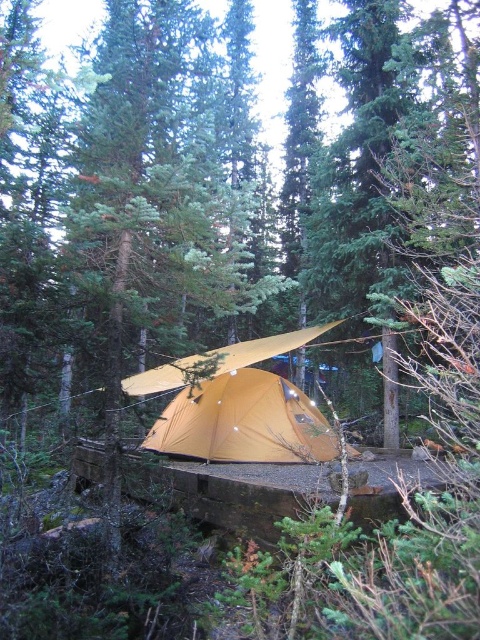
Question: Which point appears closest to the camera in this image?

Choices:
 (A) (252, 353)
 (B) (309, 440)

Answer: (B)

Question: Can you confirm if matte yellow tent at center is positioned above matte yellow tarp at center?

Choices:
 (A) no
 (B) yes

Answer: (A)

Question: Does matte yellow tent at center appear over matte yellow tarp at center?

Choices:
 (A) yes
 (B) no

Answer: (B)

Question: Is matte yellow tent at center behind matte yellow tarp at center?

Choices:
 (A) yes
 (B) no

Answer: (A)

Question: Which point is farther to the camera?

Choices:
 (A) matte yellow tent at center
 (B) matte yellow tarp at center

Answer: (A)

Question: Which point is farther from the camera taking this photo?

Choices:
 (A) (239, 346)
 (B) (307, 458)

Answer: (A)